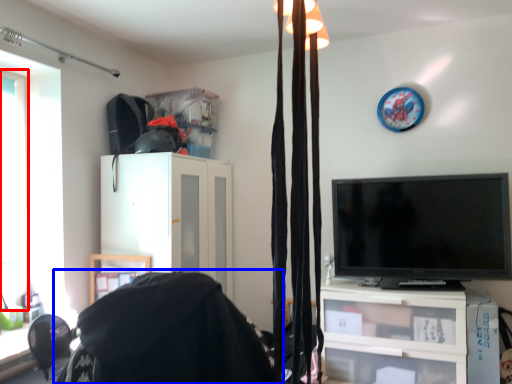
Question: Among these objects, which one is farthest to the camera, window (highlighted by a red box) or bean bag chair (highlighted by a blue box)?

Choices:
 (A) window
 (B) bean bag chair

Answer: (A)